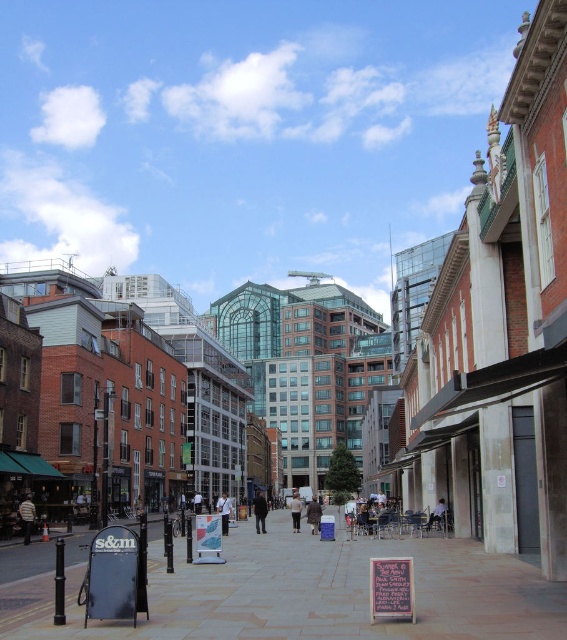
In the scene shown: Is paved stone sidewalk at center to the left of light brown wooden chair at center from the viewer's perspective?

Indeed, paved stone sidewalk at center is positioned on the left side of light brown wooden chair at center.

Can you confirm if paved stone sidewalk at center is wider than light brown wooden chair at center?

Yes, paved stone sidewalk at center is wider than light brown wooden chair at center.

You are a GUI agent. You are given a task and a screenshot of the screen. Output one action in this format:
    pyautogui.click(x=<x>, y=<y>)
    Task: Click on the paved stone sidewalk at center
    The height and width of the screenshot is (640, 567).
    Given the screenshot: What is the action you would take?
    pyautogui.click(x=310, y=593)

Does striped cotton shirt at center appear over brown leather coat at center?

Correct, striped cotton shirt at center is located above brown leather coat at center.

Find the location of a particular element. The width and height of the screenshot is (567, 640). striped cotton shirt at center is located at coordinates (27, 516).

The image size is (567, 640). Find the location of `striped cotton shirt at center`. striped cotton shirt at center is located at coordinates (27, 516).

Is light brown wooden chair at center smaller than light blue shirt at center?

Indeed, light brown wooden chair at center has a smaller size compared to light blue shirt at center.

Which of these two, light brown wooden chair at center or light blue shirt at center, stands taller?

light blue shirt at center

You are a GUI agent. You are given a task and a screenshot of the screen. Output one action in this format:
    pyautogui.click(x=<x>, y=<y>)
    Task: Click on the light brown wooden chair at center
    
    Given the screenshot: What is the action you would take?
    pyautogui.click(x=437, y=515)